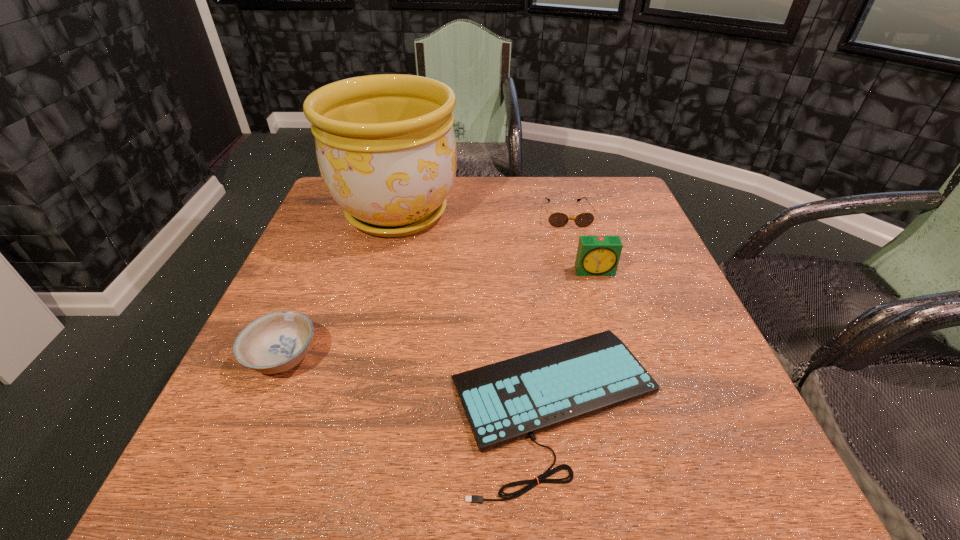
The image size is (960, 540). What are the coordinates of `blank region between the alarm clock and the bowl` in the screenshot? It's located at (439, 314).

Locate an element on the screen. This screenshot has width=960, height=540. free space between the alarm clock and the shortest object is located at coordinates [575, 337].

Identify the location of vacant space in between the alarm clock and the tallest object. (496, 242).

The image size is (960, 540). Find the location of `free space between the shortest object and the sunglasses`. free space between the shortest object and the sunglasses is located at coordinates (561, 309).

Where is `vacant space that's between the tallest object and the second tallest object`? The width and height of the screenshot is (960, 540). vacant space that's between the tallest object and the second tallest object is located at coordinates (496, 242).

Identify the location of free space between the bowl and the computer keyboard. (419, 380).

What are the coordinates of `vacant area that lies between the computer keyboard and the tallest object` in the screenshot? It's located at (476, 308).

Locate an element on the screen. The width and height of the screenshot is (960, 540). free space between the sunglasses and the tallest object is located at coordinates (x=482, y=213).

Identify the location of free space between the shortest object and the third tallest object. click(x=419, y=380).

Locate which object ranks third in proximity to the flowerpot. Please provide its 2D coordinates. Your answer should be formatted as a tuple, i.e. [(x, y)], where the tuple contains the x and y coordinates of a point satisfying the conditions above.

[(506, 401)]